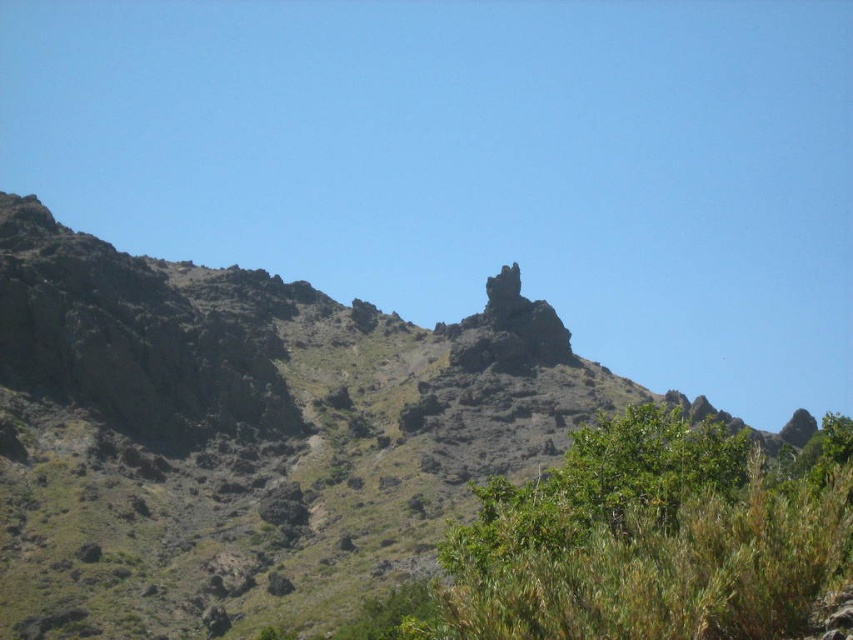
Between rugged rock formation at center and rugged stone rock formation at center, which one has more height?

With more height is rugged rock formation at center.

Is rugged rock formation at center behind rugged stone rock formation at center?

No, rugged rock formation at center is in front of rugged stone rock formation at center.

You are a GUI agent. You are given a task and a screenshot of the screen. Output one action in this format:
    pyautogui.click(x=<x>, y=<y>)
    Task: Click on the rugged rock formation at center
    This screenshot has width=853, height=640.
    Given the screenshot: What is the action you would take?
    pyautogui.click(x=233, y=442)

This screenshot has width=853, height=640. Identify the location of rugged rock formation at center. (233, 442).

Which is above, rugged rock formation at center or green leafy shrub at center?

rugged rock formation at center is higher up.

Does point (229, 563) come behind point (798, 616)?

That is True.

Where is `rugged rock formation at center`? This screenshot has width=853, height=640. rugged rock formation at center is located at coordinates (233, 442).

Is green leafy shrub at center positioned behind rugged stone rock formation at center?

No, green leafy shrub at center is closer to the viewer.

Which of these two, green leafy shrub at center or rugged stone rock formation at center, stands taller?

green leafy shrub at center

Does point (747, 460) come closer to viewer compared to point (465, 358)?

Yes, it is in front of point (465, 358).

Identify the location of green leafy shrub at center. click(x=648, y=540).